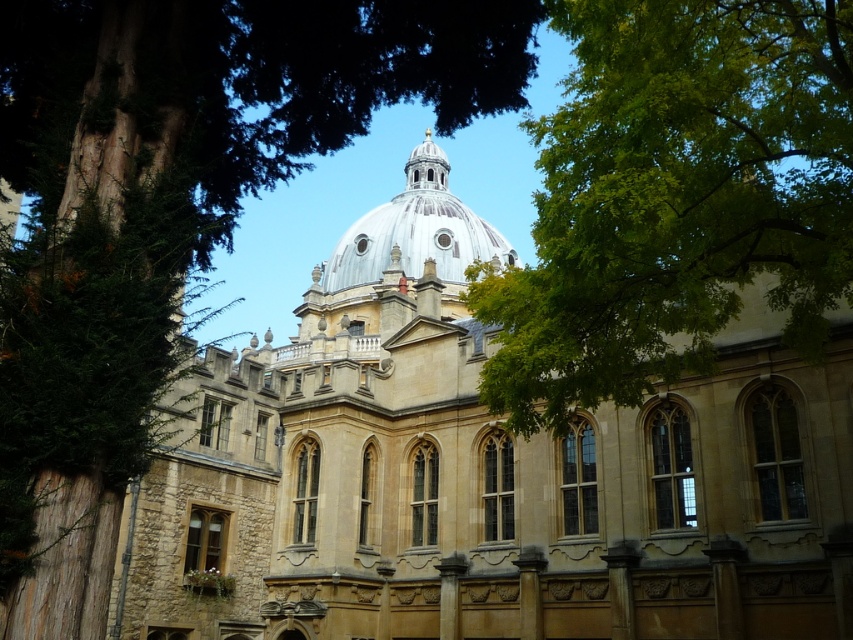
Question: Is light brown stone church at center further to camera compared to white stone dome at center?

Choices:
 (A) no
 (B) yes

Answer: (A)

Question: Does green leafy tree at upper left have a larger size compared to white stone dome at center?

Choices:
 (A) yes
 (B) no

Answer: (A)

Question: Can you confirm if green leafy tree at upper center is positioned to the left of white stone dome at center?

Choices:
 (A) yes
 (B) no

Answer: (B)

Question: Among these points, which one is nearest to the camera?

Choices:
 (A) (445, 216)
 (B) (175, 77)

Answer: (B)

Question: Which point appears farthest from the camera in this image?

Choices:
 (A) (830, 116)
 (B) (343, 124)
 (C) (256, 348)

Answer: (C)

Question: Among these points, which one is farthest from the camera?

Choices:
 (A) (596, 534)
 (B) (561, 200)

Answer: (A)